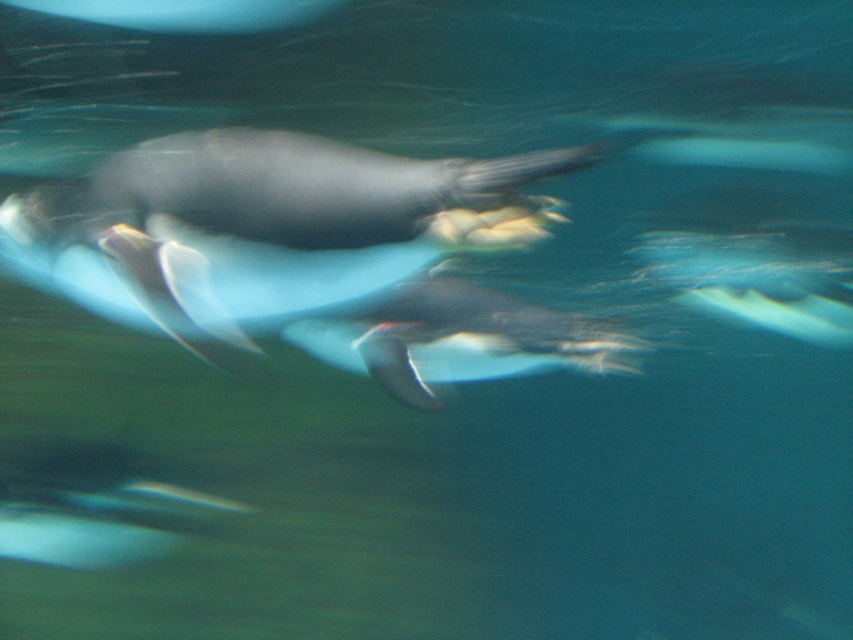
You are a marine biologist observing two penguins in an underwater scene. You need to determine which penguin has a wider body. The penguins are the white matte penguin at center and the black matte penguin at lower left. Based on their positions and the scene description, which one is wider?

The white matte penguin at center has a larger width than the black matte penguin at lower left according to the description.